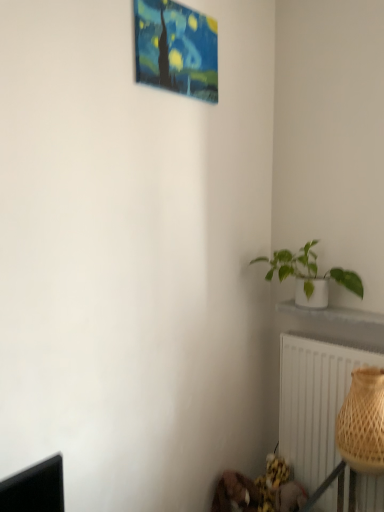
Question: From a real-world perspective, is painted canvas painting at upper center located beneath white ceramic plant pot at lower right?

Choices:
 (A) yes
 (B) no

Answer: (B)

Question: Is painted canvas painting at upper center bigger than white ceramic plant pot at lower right?

Choices:
 (A) no
 (B) yes

Answer: (B)

Question: Considering the relative sizes of painted canvas painting at upper center and white ceramic plant pot at lower right in the image provided, is painted canvas painting at upper center smaller than white ceramic plant pot at lower right?

Choices:
 (A) no
 (B) yes

Answer: (A)

Question: Does painted canvas painting at upper center have a greater height compared to white ceramic plant pot at lower right?

Choices:
 (A) yes
 (B) no

Answer: (A)

Question: From the image's perspective, is painted canvas painting at upper center above white ceramic plant pot at lower right?

Choices:
 (A) no
 (B) yes

Answer: (B)

Question: Are painted canvas painting at upper center and white ceramic plant pot at lower right located far from each other?

Choices:
 (A) no
 (B) yes

Answer: (B)

Question: Is white matte pot at right oriented towards brown woven basket at lower right?

Choices:
 (A) no
 (B) yes

Answer: (A)

Question: Is white matte pot at right not near brown woven basket at lower right?

Choices:
 (A) yes
 (B) no

Answer: (B)

Question: Is white matte pot at right at the right side of brown woven basket at lower right?

Choices:
 (A) no
 (B) yes

Answer: (A)

Question: Is white matte pot at right shorter than brown woven basket at lower right?

Choices:
 (A) no
 (B) yes

Answer: (B)

Question: Is white matte pot at right behind brown woven basket at lower right?

Choices:
 (A) no
 (B) yes

Answer: (B)

Question: Can we say white matte pot at right lies outside brown woven basket at lower right?

Choices:
 (A) no
 (B) yes

Answer: (B)

Question: Is white matte pot at right closer to camera compared to painted canvas painting at upper center?

Choices:
 (A) yes
 (B) no

Answer: (B)